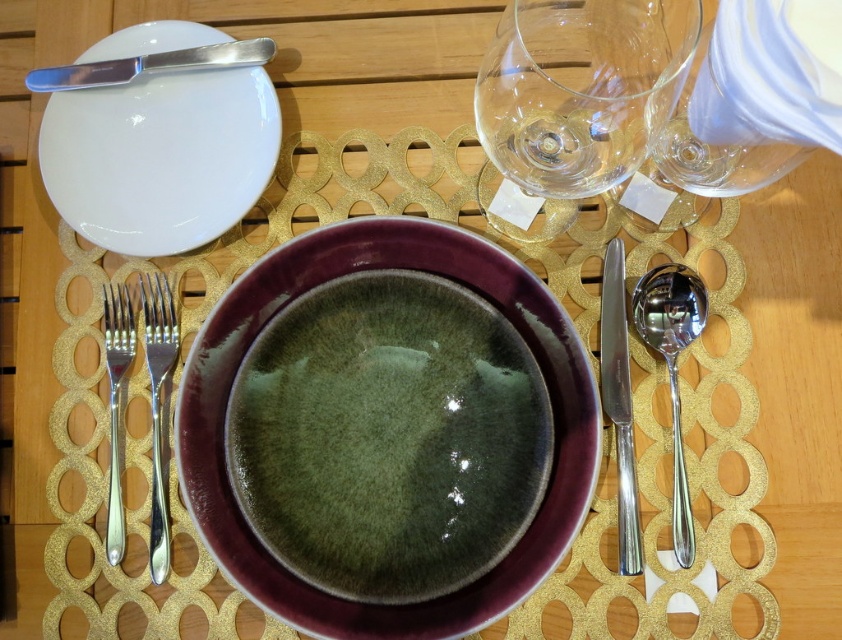
Question: Which object is positioned farthest from the white glossy plate at upper left?

Choices:
 (A) green glossy bowl at center
 (B) silver polished fork at left

Answer: (A)

Question: Which point is farther to the camera?

Choices:
 (A) green glossy bowl at center
 (B) silver polished fork at left

Answer: (B)

Question: Is white glossy plate at upper left in front of silver polished fork at left?

Choices:
 (A) no
 (B) yes

Answer: (A)

Question: Does green glossy bowl at center have a greater width compared to polished metal butter knife at upper left?

Choices:
 (A) yes
 (B) no

Answer: (A)

Question: Which point appears closest to the camera in this image?

Choices:
 (A) (196, 54)
 (B) (172, 369)

Answer: (B)

Question: Is satin silver fork at left positioned in front of polished metal butter knife at upper left?

Choices:
 (A) yes
 (B) no

Answer: (A)